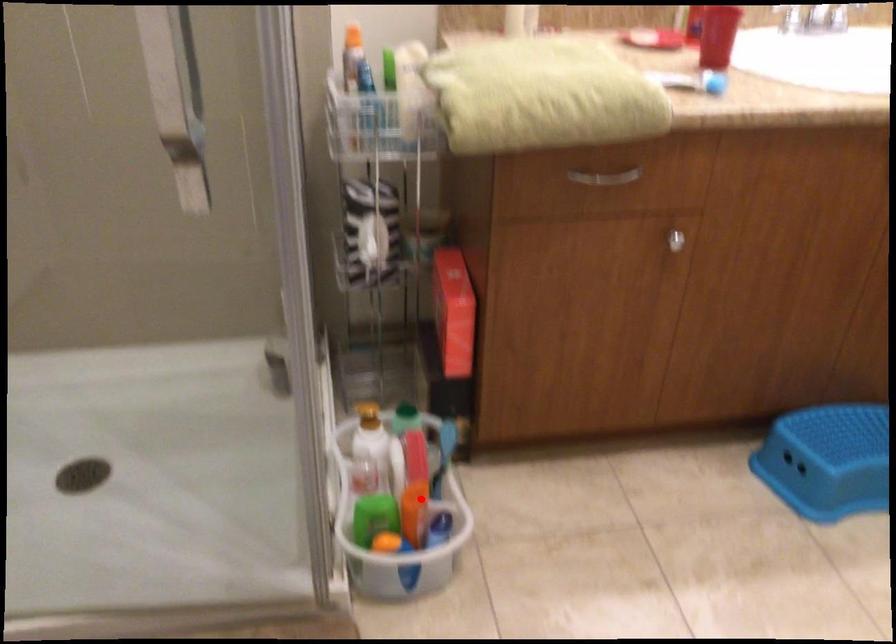
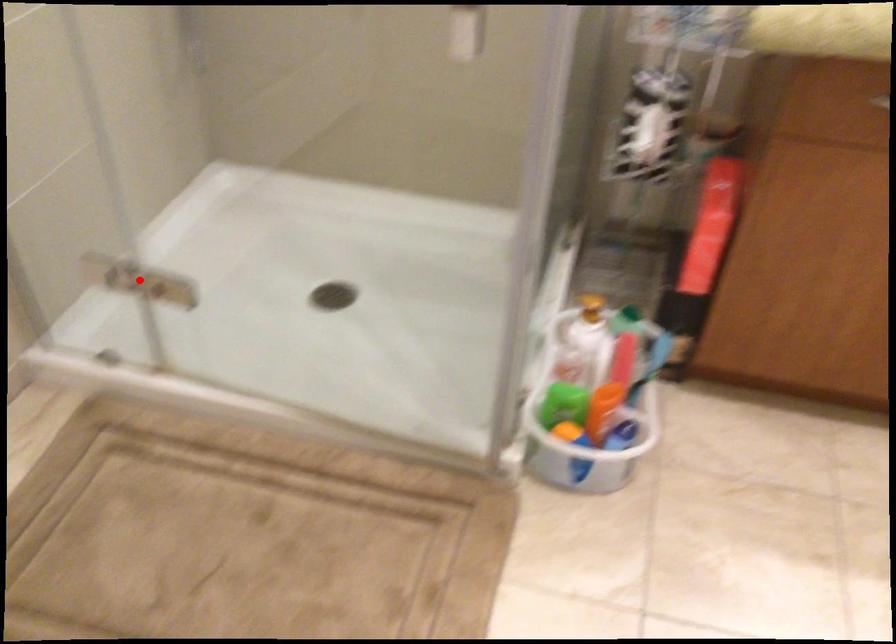
I am providing you with two images of the same scene from different viewpoints. A red point is marked on the first image and another point is marked on the second image. Are the points marked in image1 and image2 representing the same 3D position?

No